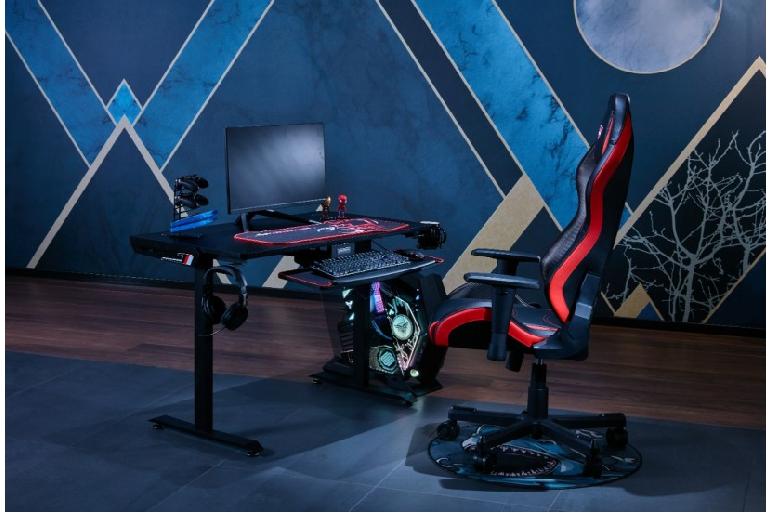
Where is `tan line on the wall`? tan line on the wall is located at coordinates (508, 223).